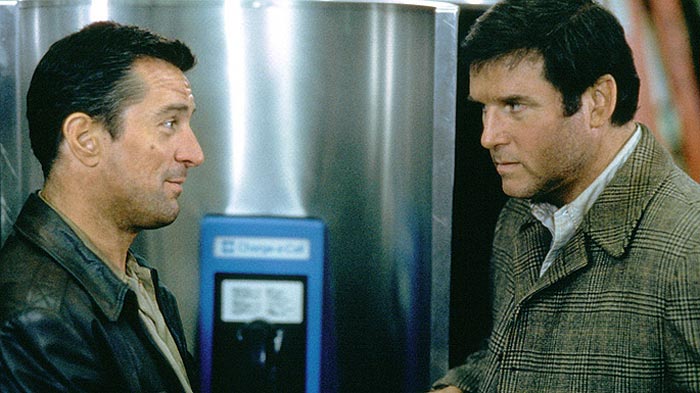
The image size is (700, 393). I want to click on stainless curved wall, so click(x=285, y=126).